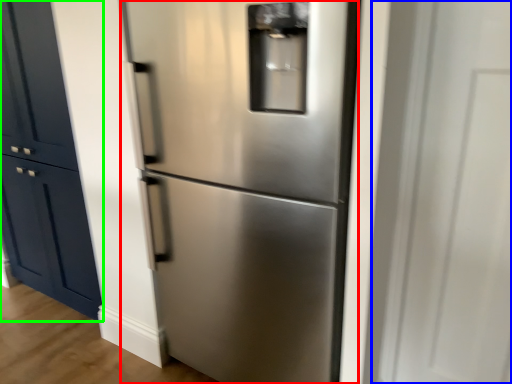
Question: Estimate the real-world distances between objects in this image. Which object is closer to refrigerator (highlighted by a red box), glass door (highlighted by a blue box) or door (highlighted by a green box)?

Choices:
 (A) glass door
 (B) door

Answer: (A)